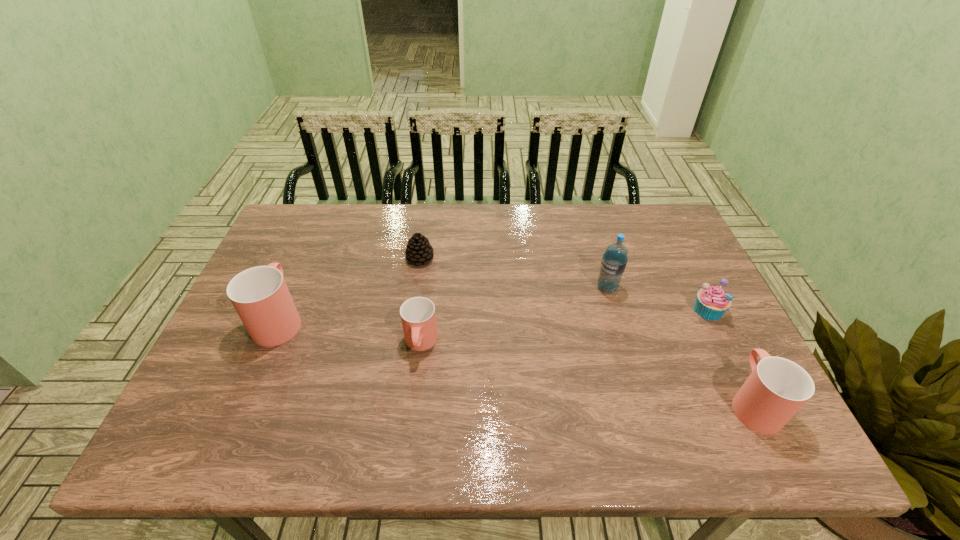
In order to click on the second closest cup to the muffin in this screenshot , I will do `click(418, 317)`.

The image size is (960, 540). Find the location of `the second closest cup to the leftmost object`. the second closest cup to the leftmost object is located at coordinates pyautogui.click(x=777, y=388).

Find the location of `vacant area that satisfies the following two spatial constraints: 1. on the side of the rightmost cup with the handle; 2. on the left side of the muffin`. vacant area that satisfies the following two spatial constraints: 1. on the side of the rightmost cup with the handle; 2. on the left side of the muffin is located at coordinates (x=707, y=310).

Image resolution: width=960 pixels, height=540 pixels. What are the coordinates of `free location that satisfies the following two spatial constraints: 1. on the side of the leftmost cup with the handle; 2. on the right side of the water bottle` in the screenshot? It's located at (293, 288).